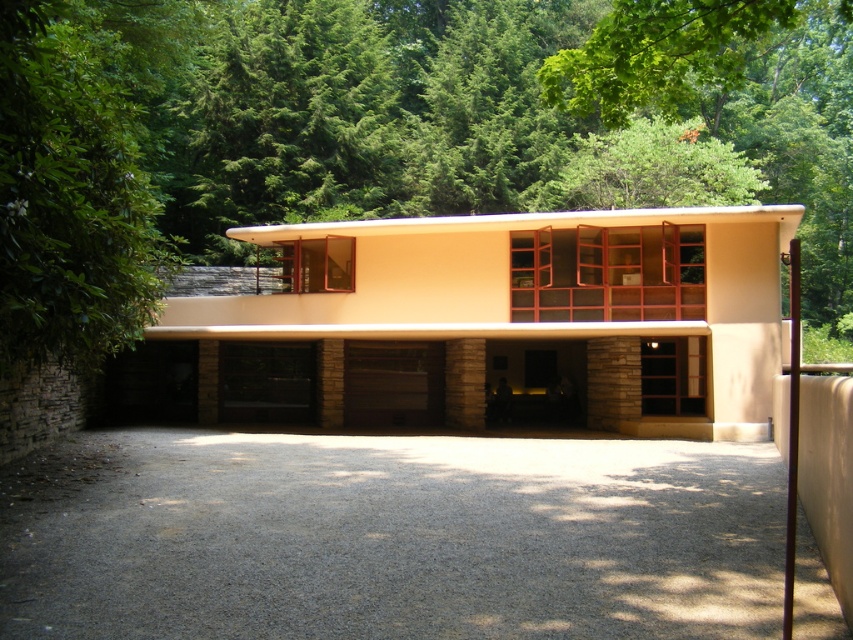
Question: Which of these objects is positioned closest to the brown stone/glass garage door at center?

Choices:
 (A) green leafy tree at upper center
 (B) beige stone garage at center
 (C) gray gravel driveway at lower center

Answer: (B)

Question: Is green leafy tree at upper center in front of gray gravel driveway at lower center?

Choices:
 (A) no
 (B) yes

Answer: (B)

Question: Which point appears closest to the camera in this image?

Choices:
 (A) (28, 58)
 (B) (648, 504)
 (C) (332, 266)

Answer: (A)

Question: Is green leafy tree at upper center thinner than gray gravel driveway at lower center?

Choices:
 (A) yes
 (B) no

Answer: (B)

Question: Estimate the real-world distances between objects in this image. Which object is closer to the beige stone garage at center?

Choices:
 (A) green leafy tree at upper center
 (B) brown stone/glass garage door at center
 (C) gray gravel driveway at lower center

Answer: (B)

Question: Is gray gravel driveway at lower center wider than brown stone/glass garage door at center?

Choices:
 (A) no
 (B) yes

Answer: (B)